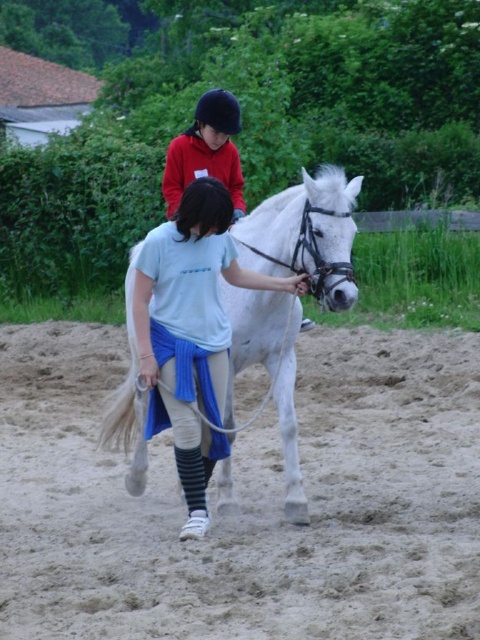
Question: Can you confirm if sandy dirt field at lower center is positioned above matte red jacket at upper center?

Choices:
 (A) no
 (B) yes

Answer: (A)

Question: Does white glossy horse at center come in front of matte red jacket at upper center?

Choices:
 (A) yes
 (B) no

Answer: (A)

Question: Which of these objects is positioned closest to the matte red jacket at upper center?

Choices:
 (A) white glossy horse at center
 (B) sandy dirt field at lower center

Answer: (A)

Question: Which of the following is the closest to the observer?

Choices:
 (A) (350, 237)
 (B) (181, 564)
 (C) (213, 154)

Answer: (A)

Question: Can you confirm if sandy dirt field at lower center is positioned above white glossy horse at center?

Choices:
 (A) yes
 (B) no

Answer: (B)

Question: Among these objects, which one is nearest to the camera?

Choices:
 (A) white glossy horse at center
 (B) sandy dirt field at lower center

Answer: (B)